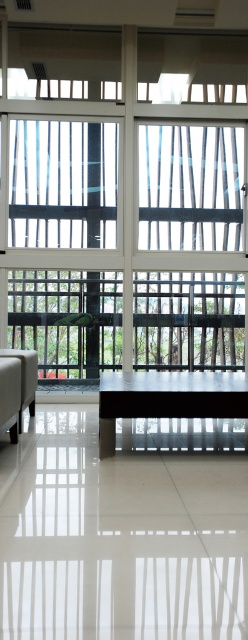
Question: Which point is farther from the camera taking this photo?

Choices:
 (A) (16, 125)
 (B) (75, 221)

Answer: (B)

Question: Does transparent glass window at center have a smaller size compared to transparent glass window at upper left?

Choices:
 (A) yes
 (B) no

Answer: (B)

Question: Does transparent glass window at center appear under transparent glass window at upper left?

Choices:
 (A) yes
 (B) no

Answer: (A)

Question: Is transparent glass window at center bigger than transparent glass window at upper left?

Choices:
 (A) yes
 (B) no

Answer: (A)

Question: Among these objects, which one is nearest to the camera?

Choices:
 (A) transparent glass window at upper left
 (B) transparent glass window at center

Answer: (B)

Question: Which object is closer to the camera taking this photo?

Choices:
 (A) transparent glass window at upper left
 (B) transparent glass window at center

Answer: (B)